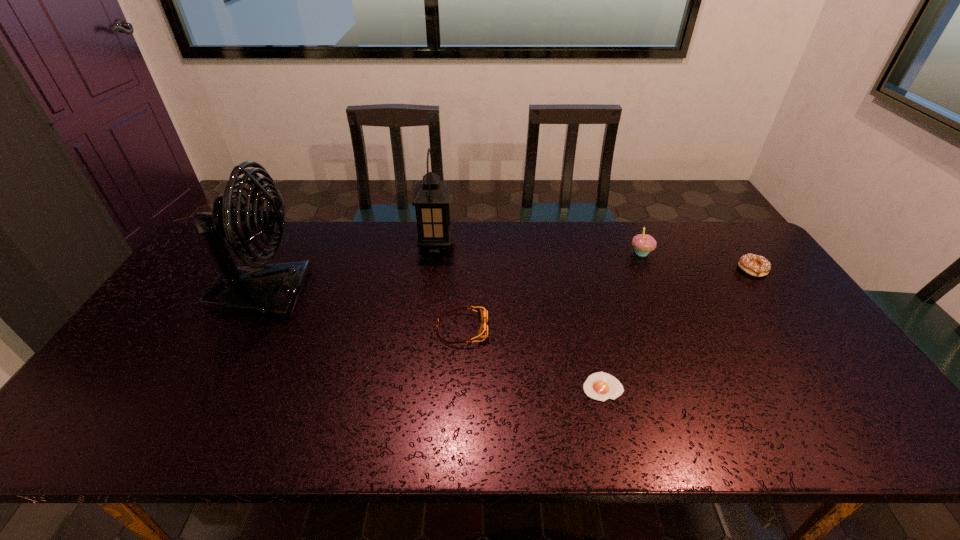
You are a GUI agent. You are given a task and a screenshot of the screen. Output one action in this format:
    pyautogui.click(x=<x>, y=<y>)
    Task: Click on the fan
    This screenshot has height=540, width=960.
    Given the screenshot: What is the action you would take?
    pyautogui.click(x=259, y=289)

Locate an element on the screen. The image size is (960, 540). the tallest object is located at coordinates (259, 289).

You are a GUI agent. You are given a task and a screenshot of the screen. Output one action in this format:
    pyautogui.click(x=<x>, y=<y>)
    Task: Click on the lantern
    The width and height of the screenshot is (960, 540).
    Given the screenshot: What is the action you would take?
    pyautogui.click(x=431, y=196)

I want to click on cupcake, so click(643, 244).

I want to click on the fourth shortest object, so click(643, 244).

What are the coordinates of `goggles` in the screenshot? It's located at (483, 314).

Find the location of `the rightmost object`. the rightmost object is located at coordinates (754, 265).

You are a GUI agent. You are given a task and a screenshot of the screen. Output one action in this format:
    pyautogui.click(x=<x>, y=<y>)
    Task: Click on the egg yolk
    This screenshot has width=960, height=540.
    Given the screenshot: What is the action you would take?
    pyautogui.click(x=600, y=386)

You are a GUI agent. You are given a task and a screenshot of the screen. Output one action in this format:
    pyautogui.click(x=<x>, y=<y>)
    Task: Click on the nearest object
    The width and height of the screenshot is (960, 540).
    Given the screenshot: What is the action you would take?
    point(600,386)

At what (x,y) coordinates should I click in order to perform the action: click on free point located 0.390m in front of the tallest object to blow air. Please return your answer as a coordinate pair (x, y). This screenshot has height=540, width=960. Looking at the image, I should click on [x=440, y=294].